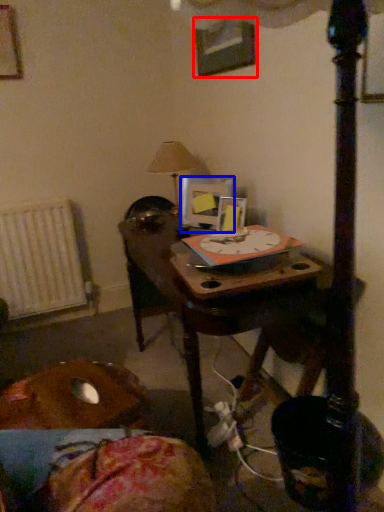
Question: Which object appears farthest to the camera in this image, picture frame (highlighted by a red box) or picture frame (highlighted by a blue box)?

Choices:
 (A) picture frame
 (B) picture frame

Answer: (B)